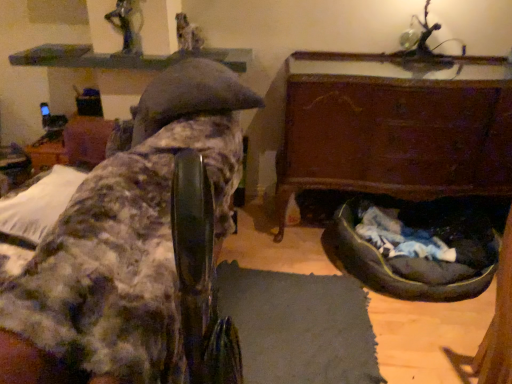
The image size is (512, 384). I want to click on spots to the right of smooth gray statue at upper center, which ranks as the 2th person in left-to-right order, so click(217, 49).